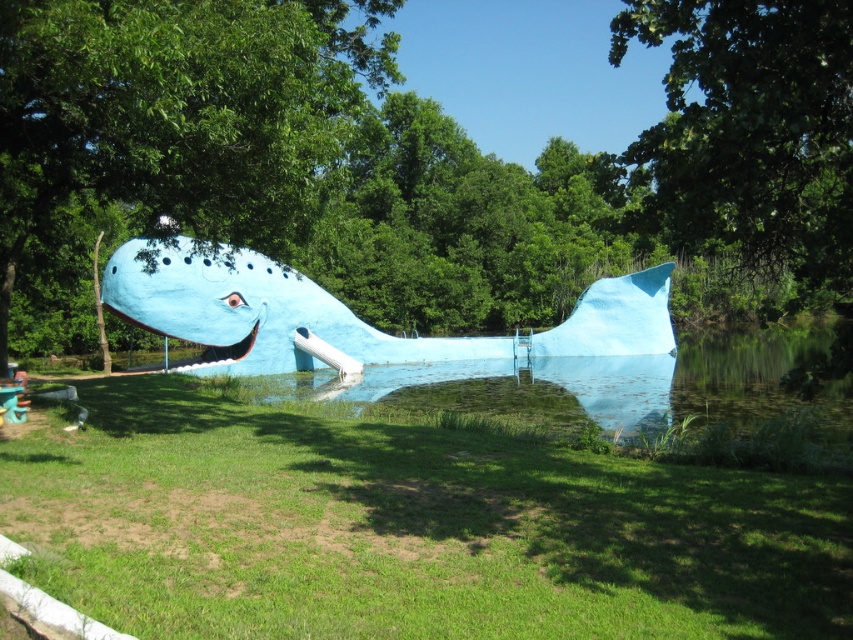
Question: Which object appears closest to the camera in this image?

Choices:
 (A) blue matte whale at center
 (B) blue smooth pond at center
 (C) green grass at lower center

Answer: (C)

Question: Which is farther from the green grass at lower center?

Choices:
 (A) blue smooth pond at center
 (B) blue matte whale at center

Answer: (B)

Question: Does green grass at lower center lie behind blue matte whale at center?

Choices:
 (A) yes
 (B) no

Answer: (B)

Question: Can you confirm if green grass at lower center is positioned to the right of blue matte whale at center?

Choices:
 (A) no
 (B) yes

Answer: (B)

Question: Can you confirm if green grass at lower center is thinner than blue matte whale at center?

Choices:
 (A) no
 (B) yes

Answer: (B)

Question: Which object is positioned closest to the green grass at lower center?

Choices:
 (A) blue smooth pond at center
 (B) blue matte whale at center

Answer: (A)